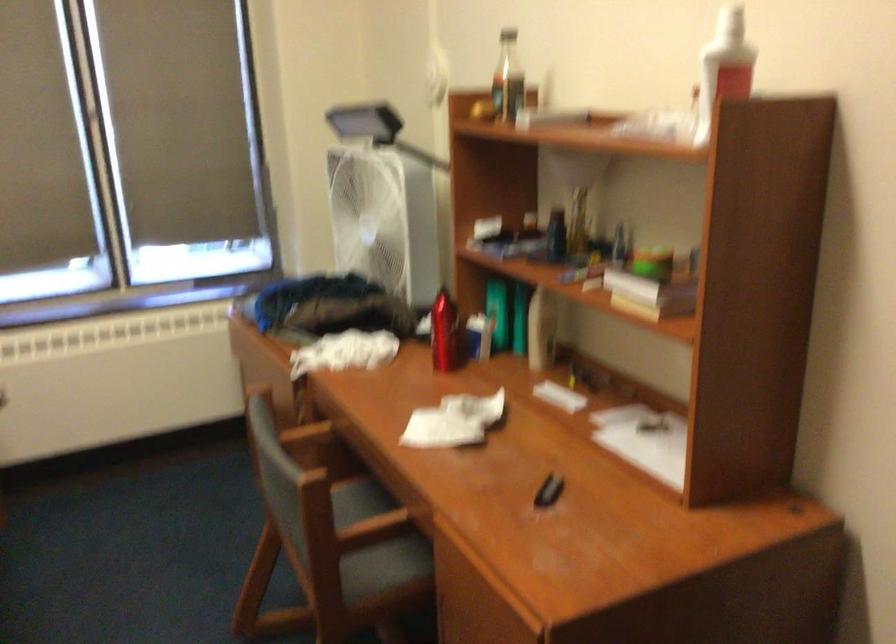
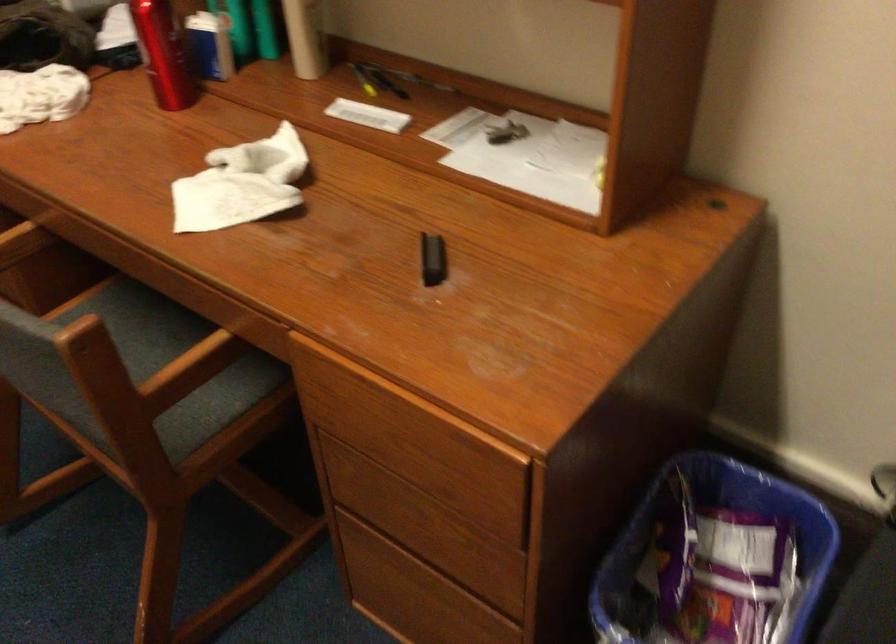
Locate, in the second image, the point that corresponds to (549,494) in the first image.

(433, 259)